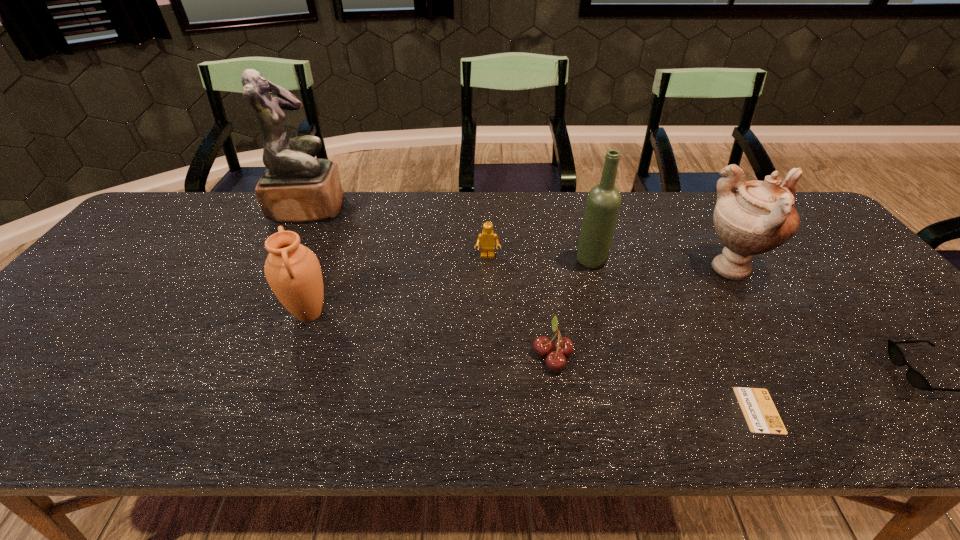
Image resolution: width=960 pixels, height=540 pixels. In order to click on free space between the sixth tallest object and the shortest object in this screenshot , I will do `click(656, 382)`.

What are the coordinates of `blank region between the cherry and the identity card` in the screenshot? It's located at (656, 382).

The image size is (960, 540). What are the coordinates of `the sixth closest object to the taller urn` in the screenshot? It's located at [293, 272].

This screenshot has width=960, height=540. What are the coordinates of `the seventh closest object to the sculpture` in the screenshot? It's located at (919, 381).

The height and width of the screenshot is (540, 960). I want to click on blank area in the image that satisfies the following two spatial constraints: 1. in a relaxed pose on the farthest object; 2. on the right side of the left urn, so click(255, 314).

This screenshot has width=960, height=540. Identify the location of vacant space that satisfies the following two spatial constraints: 1. on the back side of the taller urn; 2. on the right side of the identity card. (687, 270).